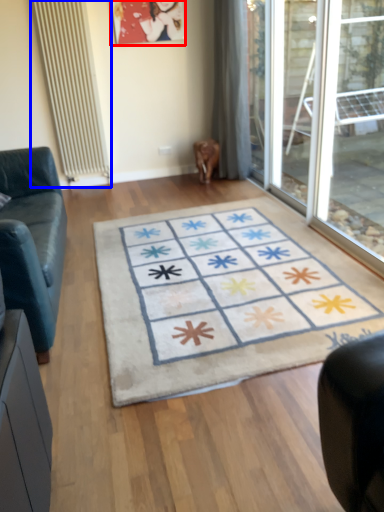
Question: Which point is further to the camera, picture frame (highlighted by a red box) or radiator (highlighted by a blue box)?

Choices:
 (A) picture frame
 (B) radiator

Answer: (A)